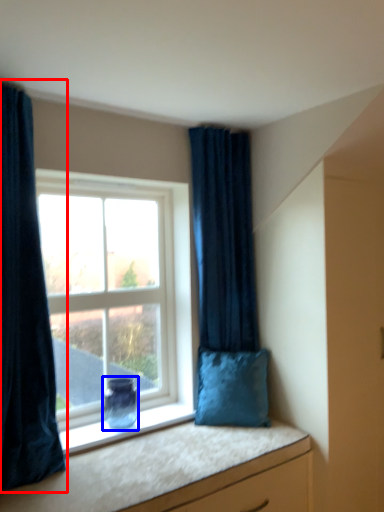
Question: Among these objects, which one is farthest to the camera, curtain (highlighted by a red box) or vase (highlighted by a blue box)?

Choices:
 (A) curtain
 (B) vase

Answer: (B)